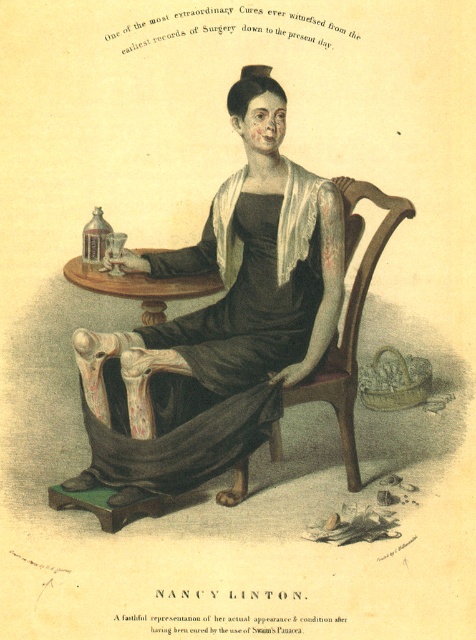
Question: Which point is farther from the camera taking this photo?

Choices:
 (A) (303, 264)
 (B) (188, 275)

Answer: (B)

Question: Does matte black dress at center appear over wooden polished table at center left?

Choices:
 (A) yes
 (B) no

Answer: (B)

Question: Among these objects, which one is farthest from the camera?

Choices:
 (A) wooden polished table at center left
 (B) matte black dress at center

Answer: (A)

Question: Does matte black dress at center have a smaller size compared to wooden polished table at center left?

Choices:
 (A) no
 (B) yes

Answer: (A)

Question: Observing the image, what is the correct spatial positioning of matte black dress at center in reference to wooden polished table at center left?

Choices:
 (A) below
 (B) above

Answer: (A)